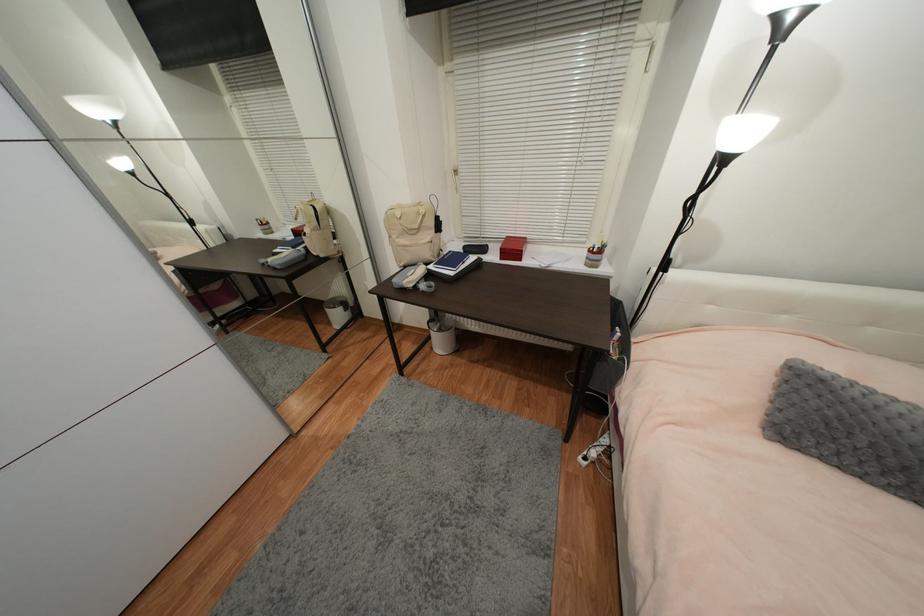
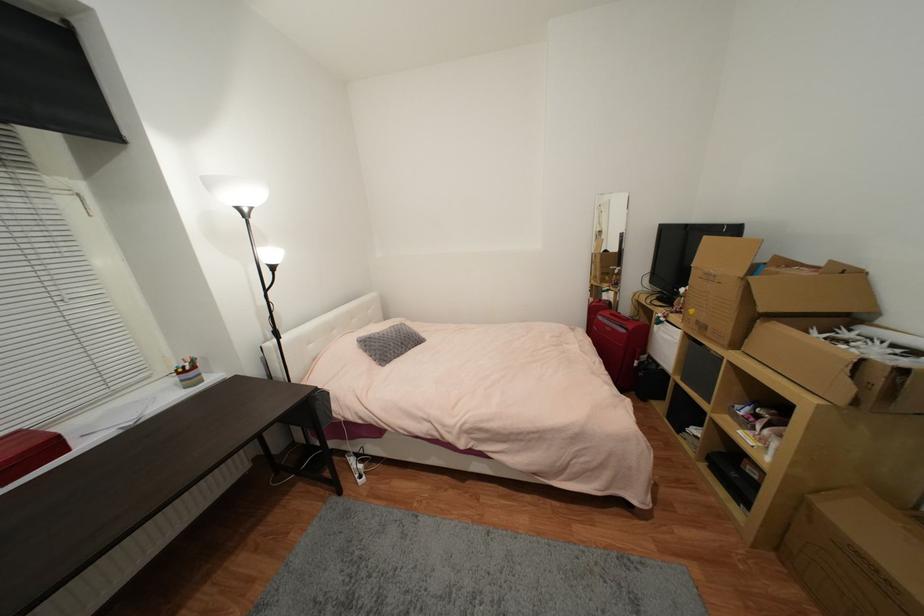
The point at (815, 363) is marked in the first image. Where is the corresponding point in the second image?

(365, 338)